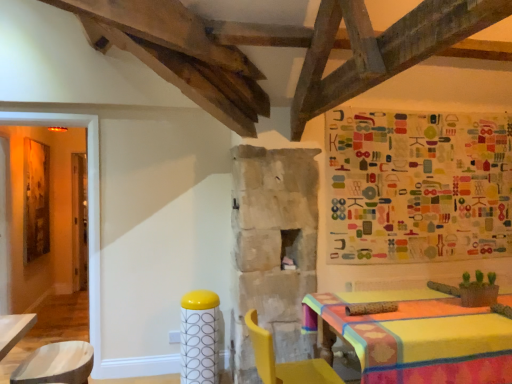
The width and height of the screenshot is (512, 384). I want to click on empty space that is ontop of multicolored fabric tapestry at upper right (from a real-world perspective), so click(422, 109).